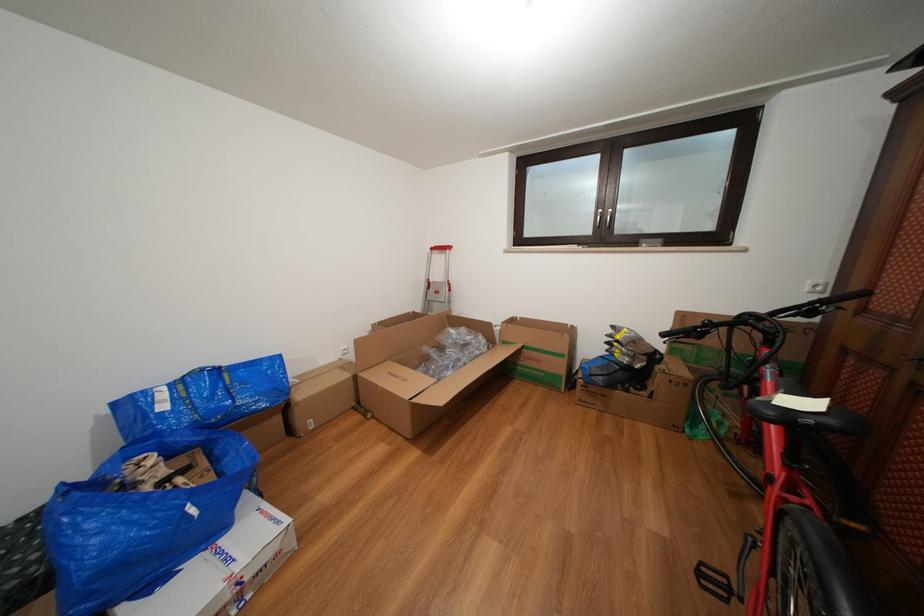
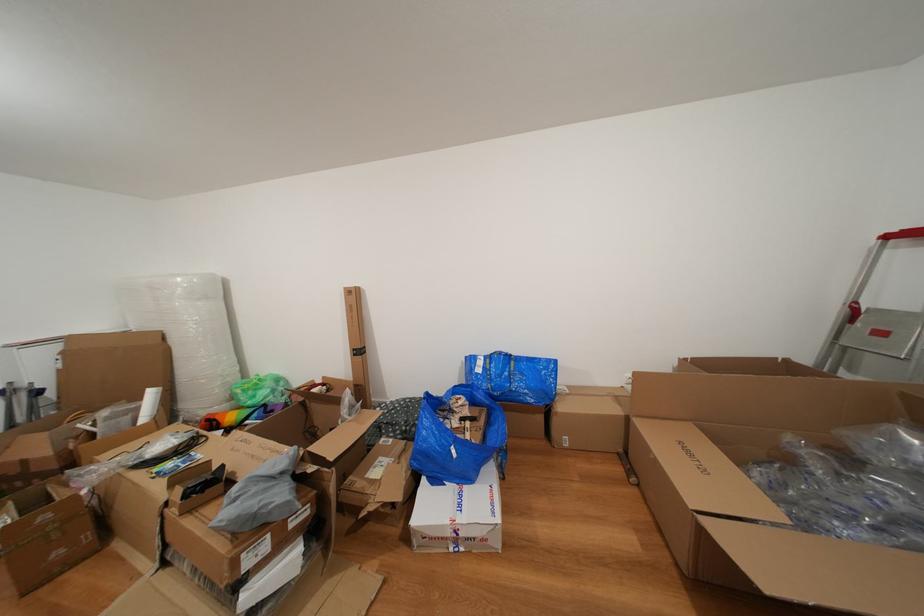
Question: The camera is either moving clockwise (left) or counter-clockwise (right) around the object. The first image is from the beginning of the video and the second image is from the end. Is the camera moving left or right when shooting the video?

Choices:
 (A) Left
 (B) Right

Answer: (B)